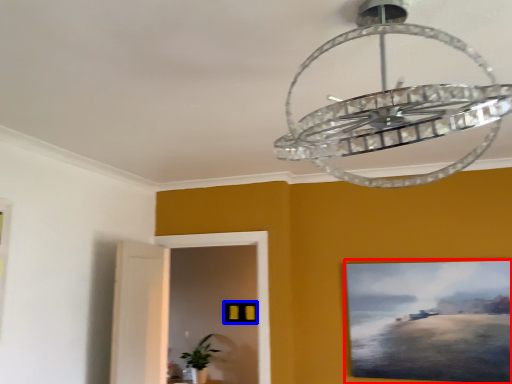
Question: Which object appears farthest to the camera in this image, picture frame (highlighted by a red box) or picture frame (highlighted by a blue box)?

Choices:
 (A) picture frame
 (B) picture frame

Answer: (B)